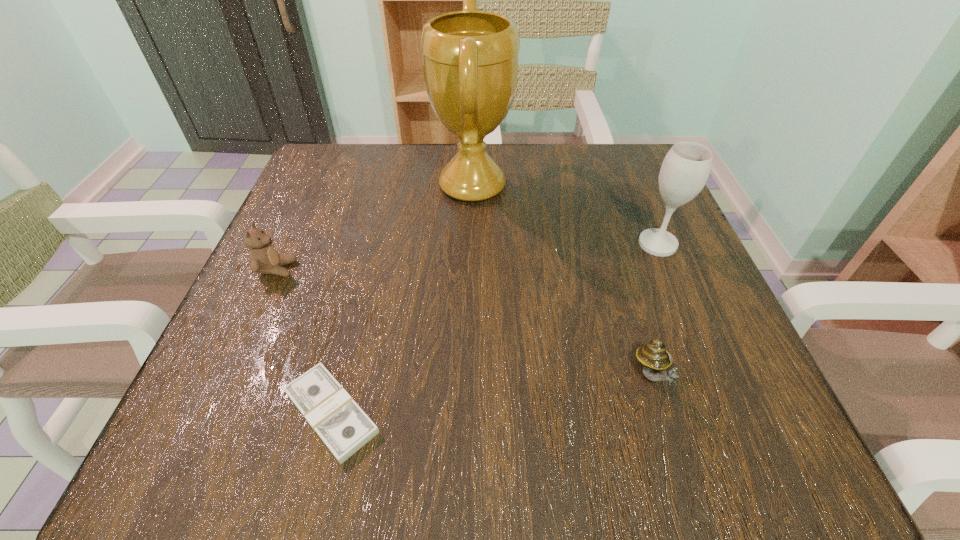
Identify the location of free region located 0.290m on the front-facing side of the teddy bear. (457, 269).

You are a GUI agent. You are given a task and a screenshot of the screen. Output one action in this format:
    pyautogui.click(x=<x>, y=<y>)
    Task: Click on the vacant position located 0.190m on the back of the shortest object
    
    Given the screenshot: What is the action you would take?
    pyautogui.click(x=366, y=275)

This screenshot has height=540, width=960. I want to click on object that is at the far edge, so click(x=470, y=58).

Identify the location of snail present at the near edge. (654, 358).

Image resolution: width=960 pixels, height=540 pixels. What are the coordinates of `dollar that is at the near edge` in the screenshot? It's located at (342, 425).

This screenshot has height=540, width=960. Identify the location of teddy bear that is at the left edge. (264, 259).

Locate an element on the screen. dollar present at the left edge is located at coordinates (342, 425).

Find the location of `wineglass present at the right edge`. wineglass present at the right edge is located at coordinates (686, 167).

You are a GUI agent. You are given a task and a screenshot of the screen. Output one action in this format:
    pyautogui.click(x=<x>, y=<y>)
    Task: Click on the snail that is at the right edge
    
    Given the screenshot: What is the action you would take?
    pyautogui.click(x=654, y=358)

Locate an element on the screen. object present at the near left corner is located at coordinates (342, 425).